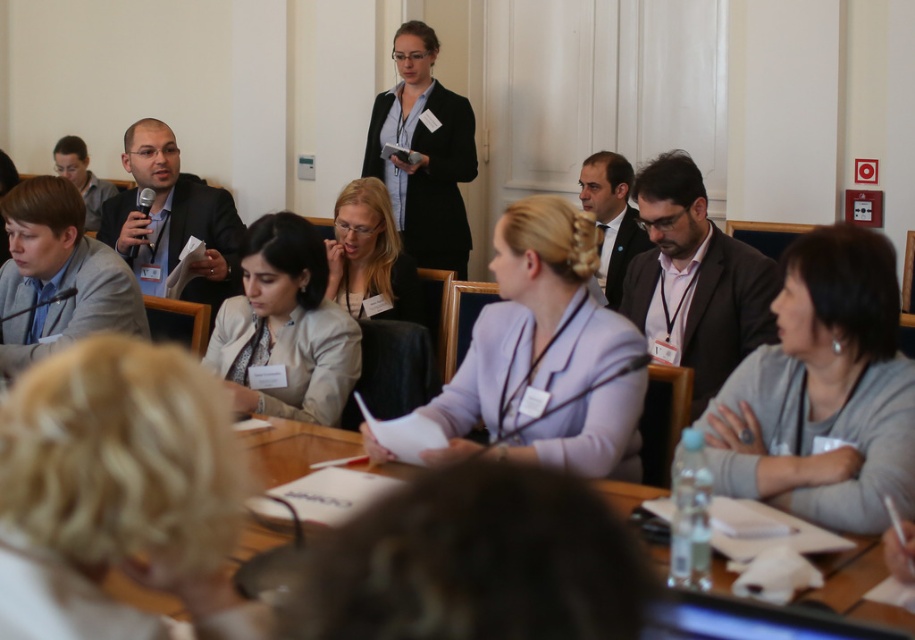
Who is higher up, gray sweater at lower right or light beige blazer at center?

Positioned higher is light beige blazer at center.

Between gray sweater at lower right and light beige blazer at center, which one appears on the right side from the viewer's perspective?

From the viewer's perspective, gray sweater at lower right appears more on the right side.

What do you see at coordinates (824, 390) in the screenshot?
I see `gray sweater at lower right` at bounding box center [824, 390].

Image resolution: width=915 pixels, height=640 pixels. I want to click on gray sweater at lower right, so click(x=824, y=390).

Measure the distance between light beige blazer at center and matte black jacket at center.

light beige blazer at center and matte black jacket at center are 28.46 inches apart from each other.

Who is positioned more to the right, light beige blazer at center or matte black jacket at center?

Positioned to the right is matte black jacket at center.

Find the location of `light beige blazer at center`. light beige blazer at center is located at coordinates (285, 326).

Which of these two, light beige blazer at center or gray suit jacket at left, stands taller?

With more height is gray suit jacket at left.

Does point (285, 252) come in front of point (27, 209)?

That is True.

Does point (267, 387) come farther from viewer compared to point (52, 305)?

No, (267, 387) is closer to viewer.

Locate an element on the screen. light beige blazer at center is located at coordinates (285, 326).